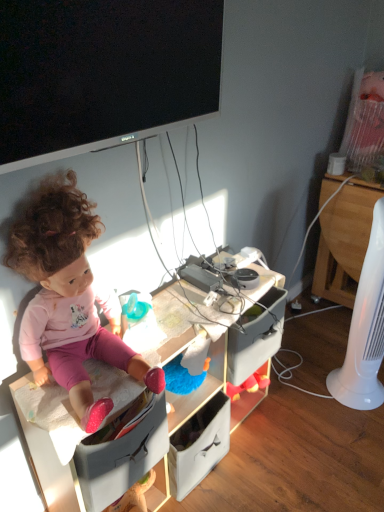
The width and height of the screenshot is (384, 512). Identify the location of unoccupied region to the right of matte plastic desk at center. click(x=300, y=440).